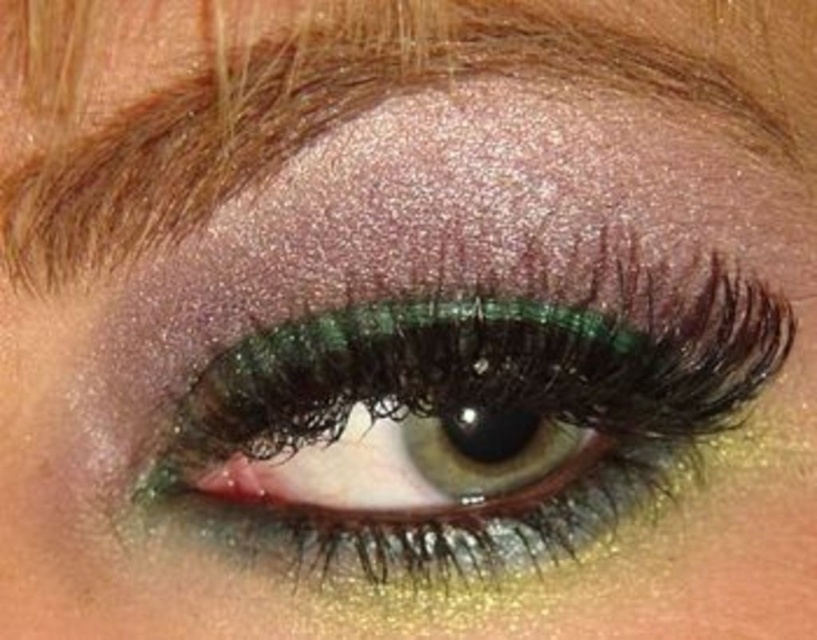
Is shiny green eyeliner at center to the left of shiny brown eyebrow at upper center from the viewer's perspective?

In fact, shiny green eyeliner at center is to the right of shiny brown eyebrow at upper center.

Locate an element on the screen. shiny green eyeliner at center is located at coordinates pyautogui.click(x=483, y=394).

In order to click on shiny green eyeliner at center in this screenshot , I will do `click(483, 394)`.